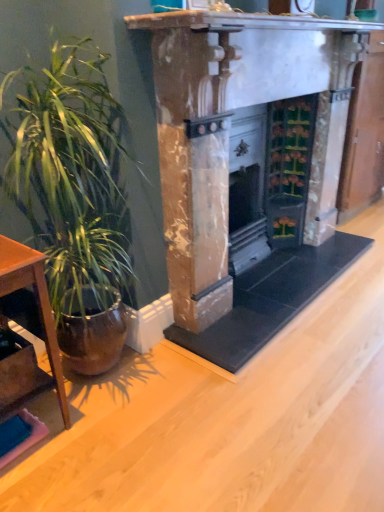
Question: Is brown wooden table at left shorter than marble fireplace at center?

Choices:
 (A) no
 (B) yes

Answer: (B)

Question: Can you confirm if brown wooden table at left is positioned to the right of marble fireplace at center?

Choices:
 (A) yes
 (B) no

Answer: (B)

Question: Does brown wooden table at left have a greater height compared to marble fireplace at center?

Choices:
 (A) no
 (B) yes

Answer: (A)

Question: Is brown wooden table at left oriented towards marble fireplace at center?

Choices:
 (A) no
 (B) yes

Answer: (A)

Question: Does brown wooden table at left contain marble fireplace at center?

Choices:
 (A) yes
 (B) no

Answer: (B)

Question: Is the position of brown wooden table at left more distant than that of marble fireplace at center?

Choices:
 (A) yes
 (B) no

Answer: (B)

Question: From a real-world perspective, does green glossy plant at left sit lower than marble fireplace at center?

Choices:
 (A) yes
 (B) no

Answer: (A)

Question: Is green glossy plant at left facing towards marble fireplace at center?

Choices:
 (A) yes
 (B) no

Answer: (B)

Question: Is green glossy plant at left behind marble fireplace at center?

Choices:
 (A) no
 (B) yes

Answer: (A)

Question: Is the surface of green glossy plant at left in direct contact with marble fireplace at center?

Choices:
 (A) no
 (B) yes

Answer: (A)

Question: Is green glossy plant at left far from marble fireplace at center?

Choices:
 (A) yes
 (B) no

Answer: (B)

Question: Is green glossy plant at left to the right of marble fireplace at center from the viewer's perspective?

Choices:
 (A) no
 (B) yes

Answer: (A)

Question: From the image's perspective, is green glossy plant at left on top of brown wooden table at left?

Choices:
 (A) yes
 (B) no

Answer: (A)